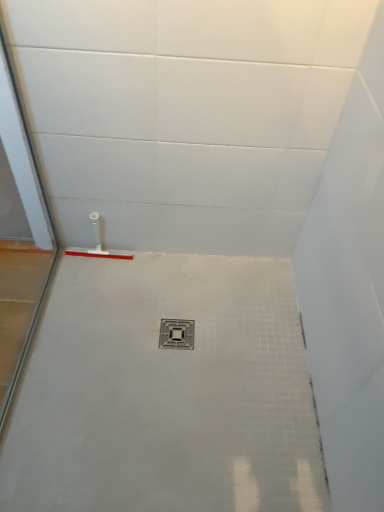
Question: Should I look upward or downward to see metallic gray drain at center?

Choices:
 (A) up
 (B) down

Answer: (B)

Question: Is the depth of white plastic squeegee at left less than that of metallic gray drain at center?

Choices:
 (A) yes
 (B) no

Answer: (B)

Question: Is white plastic squeegee at left oriented away from metallic gray drain at center?

Choices:
 (A) yes
 (B) no

Answer: (B)

Question: Is white plastic squeegee at left to the right of metallic gray drain at center from the viewer's perspective?

Choices:
 (A) yes
 (B) no

Answer: (B)

Question: Is white plastic squeegee at left directly adjacent to metallic gray drain at center?

Choices:
 (A) no
 (B) yes

Answer: (A)

Question: From a real-world perspective, is white plastic squeegee at left positioned over metallic gray drain at center based on gravity?

Choices:
 (A) yes
 (B) no

Answer: (A)

Question: Does white plastic squeegee at left have a lesser width compared to metallic gray drain at center?

Choices:
 (A) no
 (B) yes

Answer: (B)

Question: Is metallic gray drain at center to the right of white plastic squeegee at left from the viewer's perspective?

Choices:
 (A) yes
 (B) no

Answer: (A)

Question: Can you confirm if metallic gray drain at center is thinner than white plastic squeegee at left?

Choices:
 (A) no
 (B) yes

Answer: (A)

Question: From the image's perspective, is metallic gray drain at center under white plastic squeegee at left?

Choices:
 (A) no
 (B) yes

Answer: (B)

Question: Is metallic gray drain at center smaller than white plastic squeegee at left?

Choices:
 (A) yes
 (B) no

Answer: (A)

Question: Would you say white plastic squeegee at left is part of metallic gray drain at center's contents?

Choices:
 (A) no
 (B) yes

Answer: (A)

Question: From a real-world perspective, is metallic gray drain at center under white plastic squeegee at left?

Choices:
 (A) yes
 (B) no

Answer: (A)

Question: From a real-world perspective, relative to metallic gray drain at center, is white plastic squeegee at left vertically above or below?

Choices:
 (A) above
 (B) below

Answer: (A)